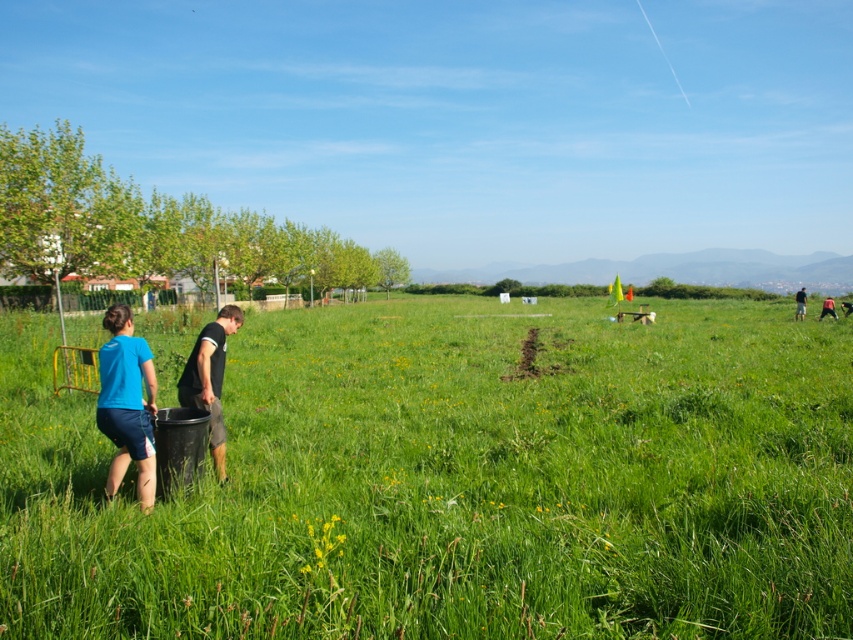
From the picture: Which is below, green grass pasture at center or dark gray fabric pants at left?

dark gray fabric pants at left is lower down.

Who is taller, green grass pasture at center or dark gray fabric pants at left?

green grass pasture at center

Describe the element at coordinates (456, 481) in the screenshot. This screenshot has width=853, height=640. I see `green grass pasture at center` at that location.

I want to click on green grass pasture at center, so click(x=456, y=481).

Which is below, green grass pasture at center or blue matte shirt at lower left?

blue matte shirt at lower left is below.

From the picture: Measure the distance between green grass pasture at center and camera.

The distance of green grass pasture at center from camera is 3.27 meters.

Identify the location of green grass pasture at center. (456, 481).

Does blue fabric couple at center have a greater width compared to dark gray fabric pants at left?

Indeed, blue fabric couple at center has a greater width compared to dark gray fabric pants at left.

Based on the photo, how far apart are blue fabric couple at center and dark gray fabric pants at left?

A distance of 25.91 inches exists between blue fabric couple at center and dark gray fabric pants at left.

Is point (132, 348) more distant than point (204, 349)?

No.

Identify the location of blue fabric couple at center. The width and height of the screenshot is (853, 640). (126, 404).